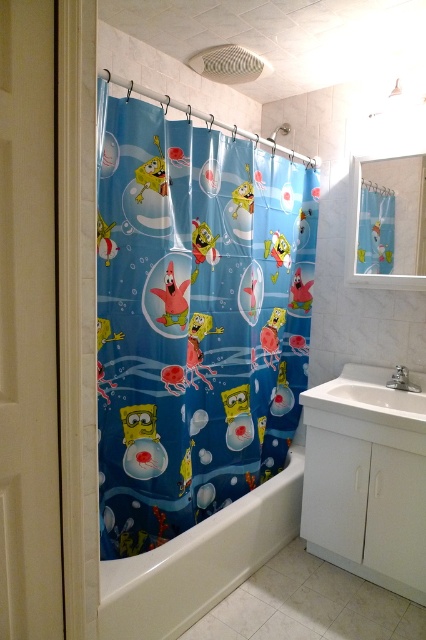
You are standing in the bathroom and want to reach both the white glossy bathtub at lower center and the white glossy sink at lower right. Which object will you encounter first as you move forward?

You will encounter the white glossy bathtub at lower center first because it is closer to you than the white glossy sink at lower right.

You are a child trying to reach the blue fabric sponge at upper right while sitting in the bathtub. The blue plastic cartoon characters at center are in your way. Can you move them out of the way to get to the sponge?

The blue plastic cartoon characters at center are closer to you than the blue fabric sponge at upper right, so you can move them aside to reach the sponge.